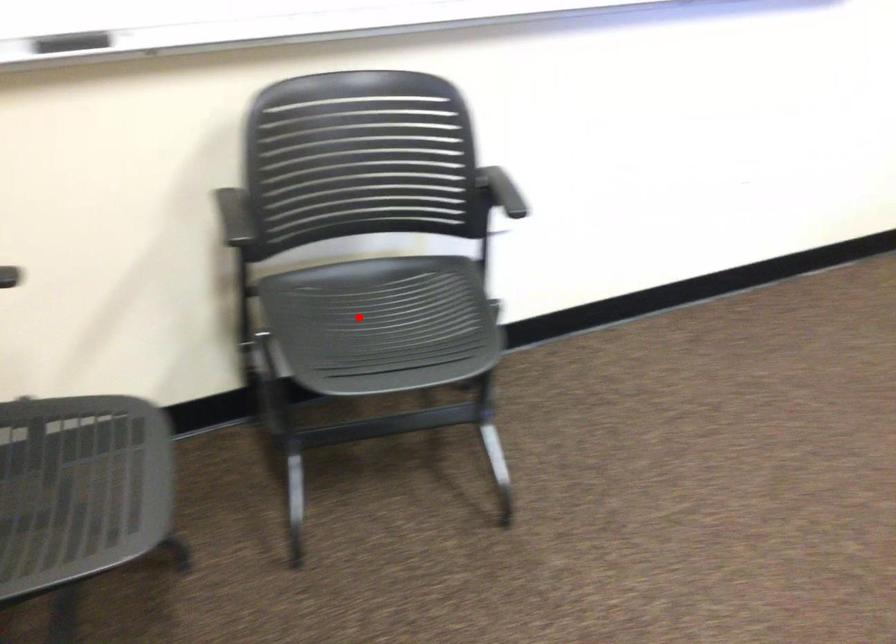
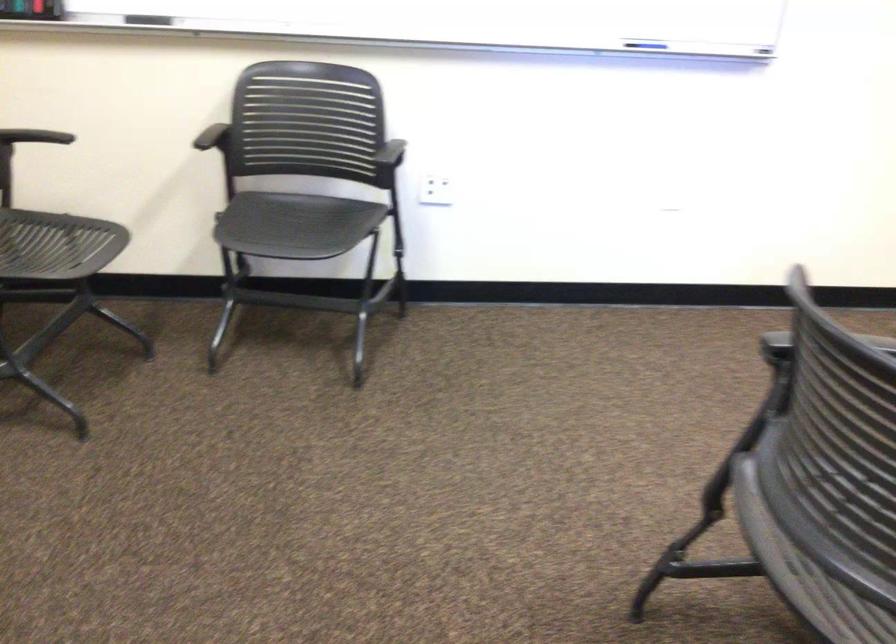
Find the pixel in the second image that matches the highlighted location in the first image.

(295, 225)